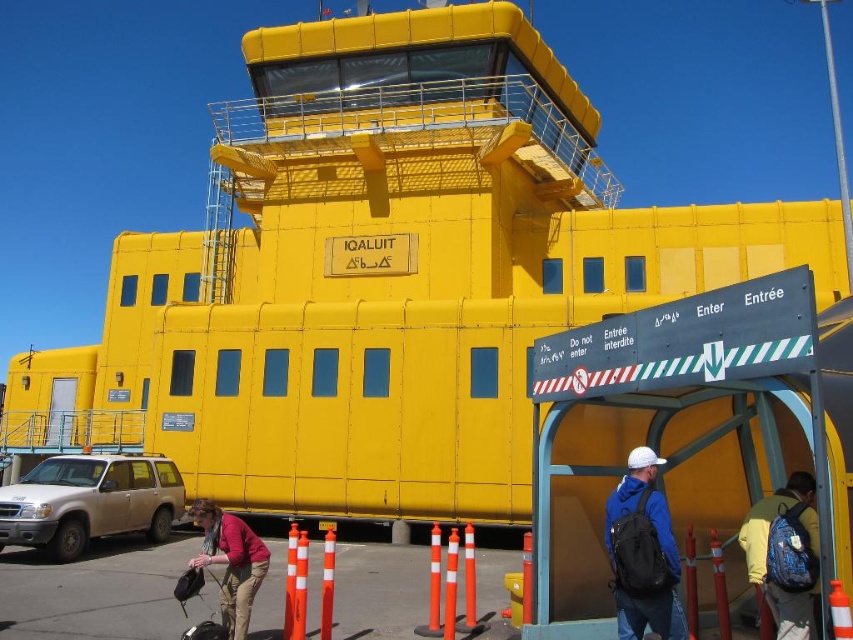
You are standing in front of the IQALUIT building and see the silver metallic suv at lower left and the matte pink sweater at lower left. Which object is closer to you?

The silver metallic suv at lower left is closer to you because it is further to the viewer than the matte pink sweater at lower left.

You are a delivery person who needs to place a package on the blue fabric backpack at center and the matte pink sweater at lower left. Which object should you choose if you want to place the package on the taller object?

The matte pink sweater at lower left is taller than the blue fabric backpack at center, so you should place the package on the matte pink sweater at lower left.

You are a delivery person standing near the blue backpack at lower right. You need to reach the orange plastic cone at center to pick it up. Can you walk straight towards it without moving the backpack?

The orange plastic cone at center is behind the blue backpack at lower right, so you cannot walk straight towards it without moving the backpack.